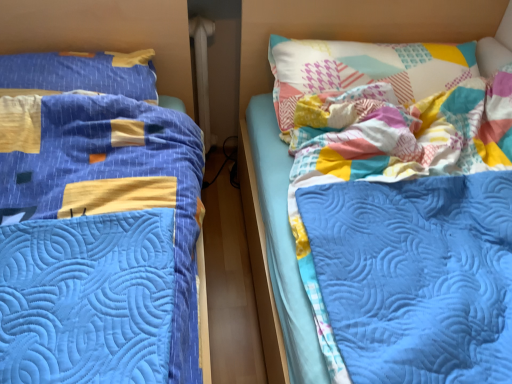
Question: Is patchwork fabric pillow at upper right, acting as the second pillow starting from the left, situated inside blue quilted bed at left or outside?

Choices:
 (A) inside
 (B) outside

Answer: (B)

Question: In terms of size, does patchwork fabric pillow at upper right, acting as the second pillow starting from the left, appear bigger or smaller than blue quilted bed at left?

Choices:
 (A) small
 (B) big

Answer: (A)

Question: Based on their relative distances, which object is nearer to the blue quilted pillow at left, placed as the first pillow when sorted from left to right?

Choices:
 (A) blue quilted bed at left
 (B) patchwork fabric pillow at upper right, acting as the second pillow starting from the left

Answer: (A)

Question: Which object is positioned farthest from the patchwork fabric pillow at upper right, which is the 1th pillow in right-to-left order?

Choices:
 (A) blue quilted bed at left
 (B) blue quilted pillow at left, placed as the first pillow when sorted from left to right

Answer: (B)